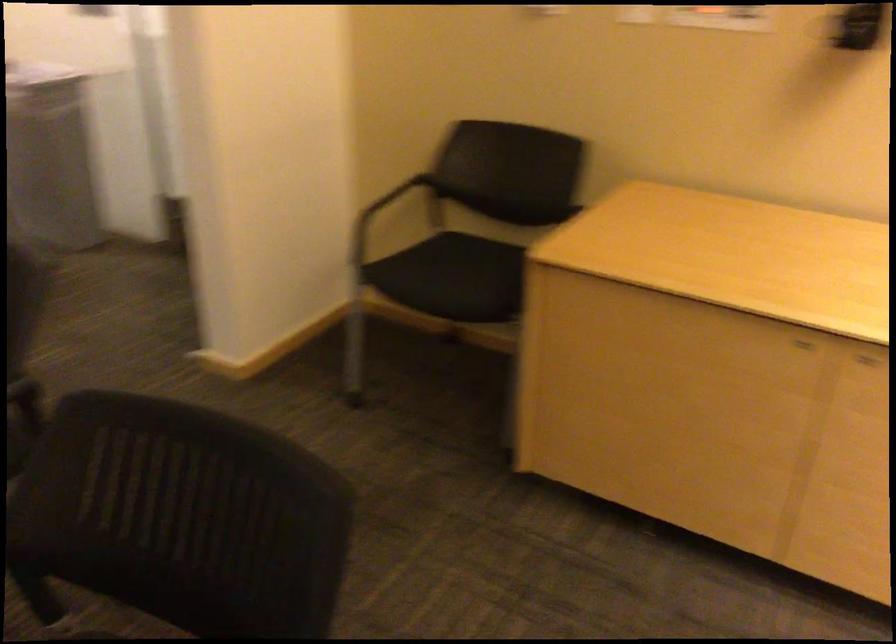
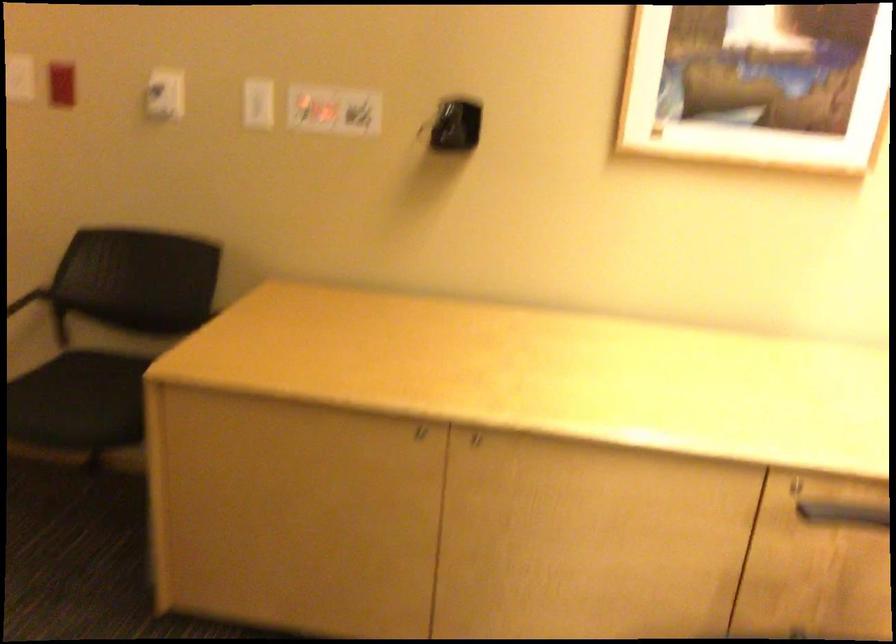
Question: The camera is either moving clockwise (left) or counter-clockwise (right) around the object. The first image is from the beginning of the video and the second image is from the end. Is the camera moving left or right when shooting the video?

Choices:
 (A) Left
 (B) Right

Answer: (A)